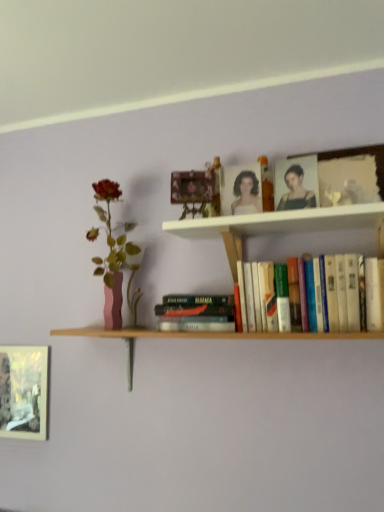
Question: Considering the positions of matte pink vase at left and white wooden shelf at upper center in the image, is matte pink vase at left wider or thinner than white wooden shelf at upper center?

Choices:
 (A) wide
 (B) thin

Answer: (B)

Question: In the image, is matte pink vase at left positioned in front of or behind white wooden shelf at upper center?

Choices:
 (A) behind
 (B) front

Answer: (A)

Question: Which is nearer to the matte black portrait at upper center?

Choices:
 (A) metallic gold picture frame at upper center, the second picture frame from the bottom
 (B) metallic silver frame at lower left, the first picture frame from the left
 (C) hardcover book at center, acting as the 1th book starting from the left
 (D) white wooden shelf at upper center
 (E) hardcover books at center, the first book from the right

Answer: (D)

Question: Which of these objects is positioned farthest from the metallic gold picture frame at upper center, the second picture frame from the bottom?

Choices:
 (A) matte black portrait at upper center
 (B) metallic silver frame at lower left, which is counted as the 2th picture frame, starting from the front
 (C) white wooden shelf at upper center
 (D) matte pink vase at left
 (E) hardcover books at center, the first book from the right

Answer: (B)